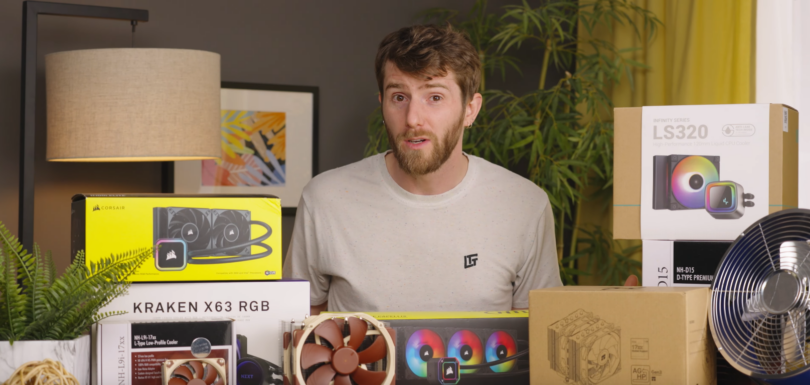
You are a GUI agent. You are given a task and a screenshot of the screen. Output one action in this format:
    pyautogui.click(x=<x>, y=<y>)
    Task: Click on the yellow curtain in a room
    This screenshot has height=385, width=810.
    Given the screenshot: What is the action you would take?
    pyautogui.click(x=693, y=52)